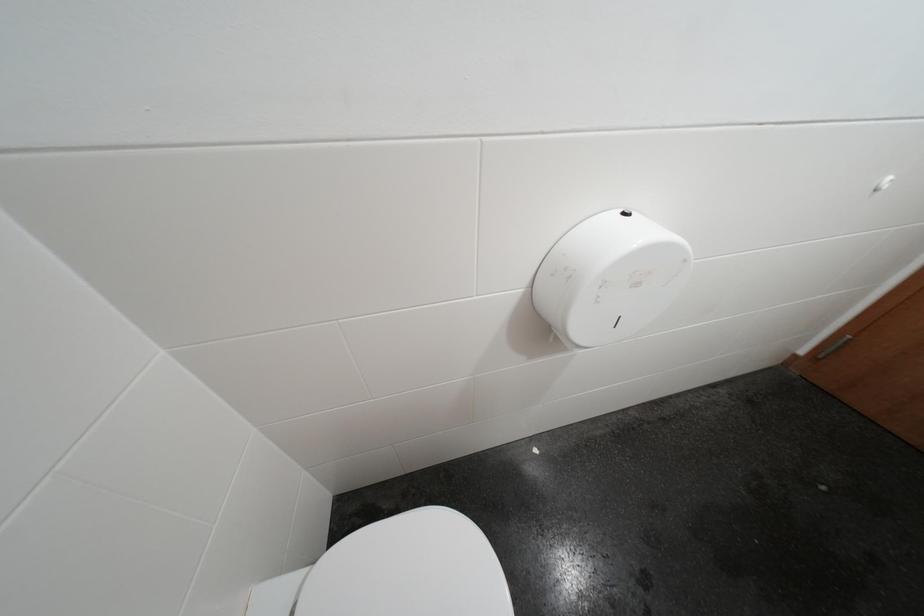
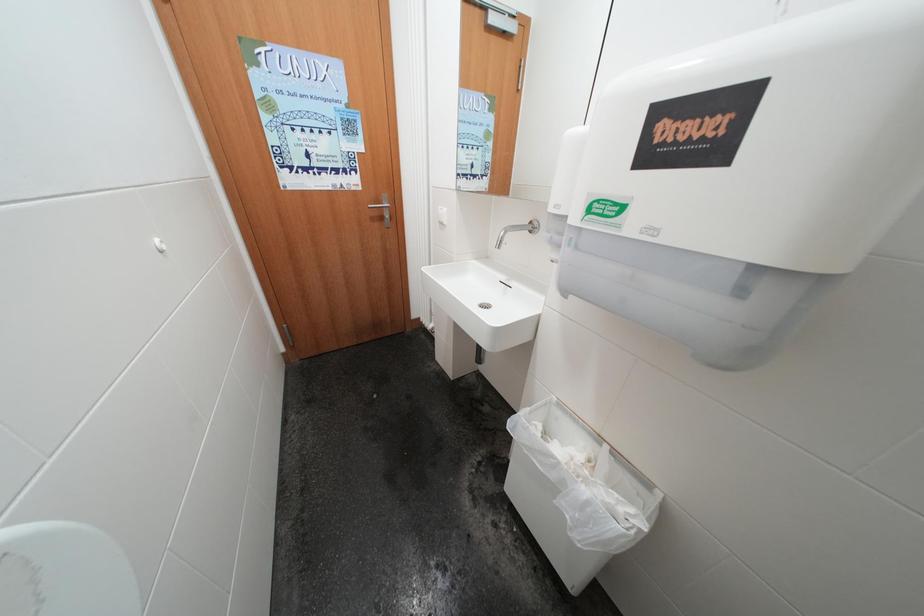
The first image is from the beginning of the video and the second image is from the end. How did the camera likely rotate when shooting the video?

The camera's rotation is toward right-down.